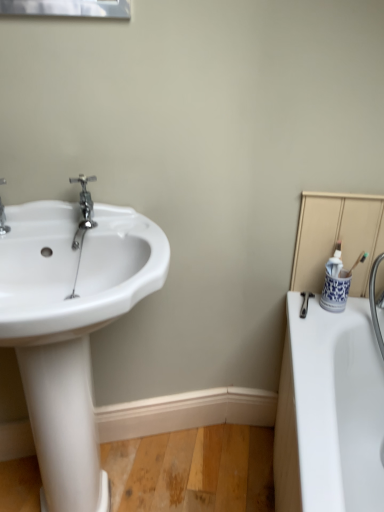
You are a GUI agent. You are given a task and a screenshot of the screen. Output one action in this format:
    pyautogui.click(x=<x>, y=<y>)
    Task: Click on the blue and white ceramic cup at right
    The width and height of the screenshot is (384, 512).
    Given the screenshot: What is the action you would take?
    pyautogui.click(x=335, y=283)

Image resolution: width=384 pixels, height=512 pixels. Describe the element at coordinates (335, 283) in the screenshot. I see `blue and white ceramic cup at right` at that location.

Find the location of a particular element. This screenshot has height=512, width=384. polished chrome faucet at left is located at coordinates (84, 209).

Find the location of a particular element. Image resolution: width=384 pixels, height=512 pixels. white glossy sink at left is located at coordinates (70, 327).

From a real-world perspective, which is physically above, polished chrome faucet at left or white glossy sink at left?

In real-world perspective, polished chrome faucet at left is above.

Is polished chrome faucet at left to the right of white glossy sink at left from the viewer's perspective?

Yes.

In the scene shown: From the image's perspective, which is below, polished chrome faucet at left or white glossy sink at left?

white glossy sink at left appears lower in the image.

Considering the relative positions of white glossy sink at left and polished chrome faucet at left in the image provided, is white glossy sink at left to the left of polished chrome faucet at left from the viewer's perspective?

Yes.

Is polished chrome faucet at left completely or partially inside white glossy sink at left?

Yes.

From a real-world perspective, is white glossy sink at left positioned over polished chrome faucet at left based on gravity?

No, from a real-world perspective, white glossy sink at left is not on top of polished chrome faucet at left.

Which of these two, white glossy sink at left or polished chrome faucet at left, stands taller?

With more height is white glossy sink at left.

Considering the sizes of blue and white ceramic cup at right and white glossy sink at left in the image, is blue and white ceramic cup at right bigger or smaller than white glossy sink at left?

In the image, blue and white ceramic cup at right appears to be smaller than white glossy sink at left.

Can you confirm if blue and white ceramic cup at right is thinner than white glossy sink at left?

Yes.

Could you tell me if blue and white ceramic cup at right is facing white glossy sink at left?

No, blue and white ceramic cup at right is not oriented towards white glossy sink at left.

What's the angular difference between blue and white ceramic cup at right and polished chrome faucet at left's facing directions?

The angle between the facing direction of blue and white ceramic cup at right and the facing direction of polished chrome faucet at left is 23.5 degrees.

Is blue and white ceramic cup at right wider or thinner than polished chrome faucet at left?

Clearly, blue and white ceramic cup at right has less width compared to polished chrome faucet at left.

Is polished chrome faucet at left completely or partially inside blue and white ceramic cup at right?

No.

Does point (336, 305) lie behind point (94, 222)?

Yes, point (336, 305) is behind point (94, 222).

Is polished chrome faucet at left wider than blue and white ceramic cup at right?

Correct, the width of polished chrome faucet at left exceeds that of blue and white ceramic cup at right.

Which is correct: polished chrome faucet at left is inside blue and white ceramic cup at right, or outside of it?

polished chrome faucet at left lies outside blue and white ceramic cup at right.

Is polished chrome faucet at left taller than blue and white ceramic cup at right?

No, polished chrome faucet at left is not taller than blue and white ceramic cup at right.

Is white glossy sink at left oriented away from blue and white ceramic cup at right?

No.

Is point (14, 285) closer to viewer compared to point (331, 270)?

Yes, it is in front of point (331, 270).

Are white glossy sink at left and blue and white ceramic cup at right making contact?

white glossy sink at left and blue and white ceramic cup at right are clearly separated.

Is blue and white ceramic cup at right inside white glossy sink at left?

Definitely not — blue and white ceramic cup at right is not inside white glossy sink at left.

Where is `tap above the white glossy sink at left (from a real-world perspective)`? Image resolution: width=384 pixels, height=512 pixels. tap above the white glossy sink at left (from a real-world perspective) is located at coordinates (84, 209).

Find the location of a particular element. sink that appears in front of the polished chrome faucet at left is located at coordinates (70, 327).

Based on their spatial positions, is white glossy sink at left or polished chrome faucet at left further from blue and white ceramic cup at right?

Based on the image, white glossy sink at left appears to be further to blue and white ceramic cup at right.

When comparing their distances from polished chrome faucet at left, does white glossy sink at left or blue and white ceramic cup at right seem further?

blue and white ceramic cup at right.

Looking at the image, which one is located further to blue and white ceramic cup at right, polished chrome faucet at left or white glossy sink at left?

The object further to blue and white ceramic cup at right is white glossy sink at left.

Considering their positions, is blue and white ceramic cup at right positioned further to white glossy sink at left than polished chrome faucet at left?

blue and white ceramic cup at right.

Considering their positions, is polished chrome faucet at left positioned closer to white glossy sink at left than blue and white ceramic cup at right?

Based on the image, polished chrome faucet at left appears to be nearer to white glossy sink at left.

From the image, which object appears to be farther from polished chrome faucet at left, blue and white ceramic cup at right or white glossy sink at left?

blue and white ceramic cup at right.

At what (x,y) coordinates should I click in order to perform the action: click on tap located between white glossy sink at left and blue and white ceramic cup at right in the left-right direction. Please return your answer as a coordinate pair (x, y). The width and height of the screenshot is (384, 512). Looking at the image, I should click on (84, 209).